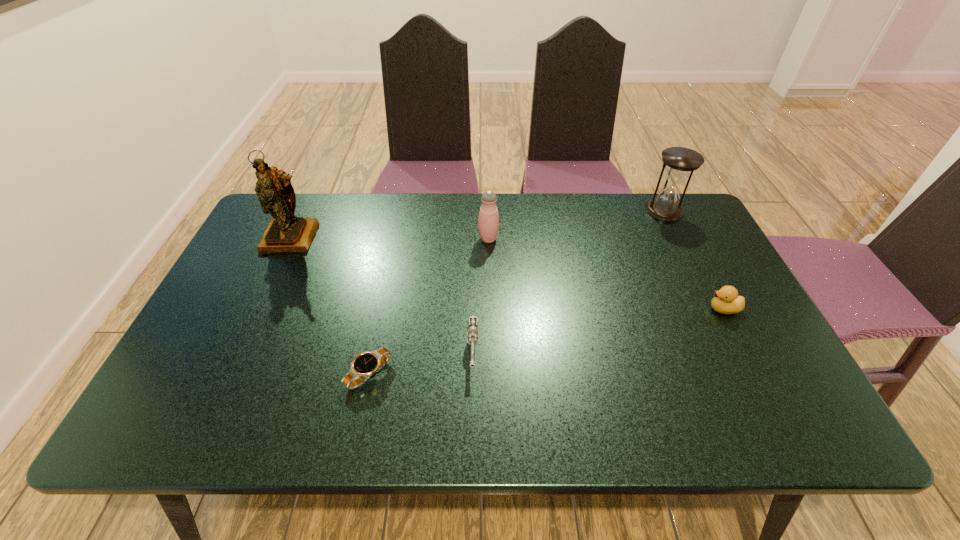
Identify the location of the leftmost object. (285, 233).

Locate an element on the screen. the tallest object is located at coordinates (285, 233).

The image size is (960, 540). What are the coordinates of `hourglass` in the screenshot? It's located at (680, 162).

This screenshot has height=540, width=960. I want to click on thermos bottle, so click(x=488, y=222).

Locate an element on the screen. The width and height of the screenshot is (960, 540). the third nearest object is located at coordinates (726, 300).

At what (x,y) coordinates should I click in order to perform the action: click on gun. Please return your answer as a coordinate pair (x, y). This screenshot has width=960, height=540. Looking at the image, I should click on (472, 335).

Identify the location of the second object from left to right. This screenshot has width=960, height=540. (364, 365).

I want to click on the shortest object, so click(x=364, y=365).

Locate an element on the screen. The height and width of the screenshot is (540, 960). vacant position located on the front-facing side of the figurine is located at coordinates (238, 352).

Where is `vacant space positioned on the front of the hourglass`? The height and width of the screenshot is (540, 960). vacant space positioned on the front of the hourglass is located at coordinates (689, 261).